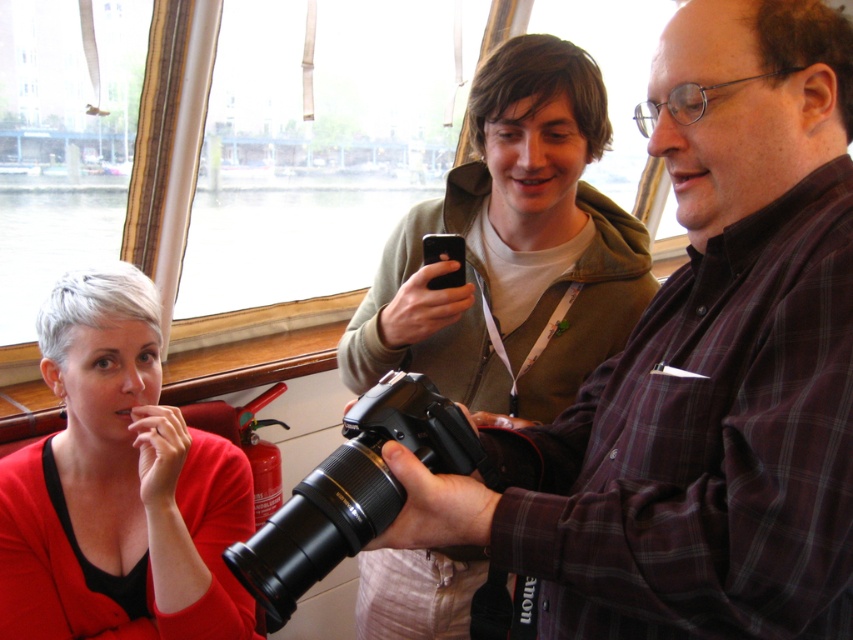
Question: Estimate the real-world distances between objects in this image. Which object is closer to the plaid fabric shirt at center?

Choices:
 (A) matte red sweater at lower left
 (B) black plastic camera at center

Answer: (B)

Question: Can you confirm if matte red sweater at lower left is smaller than black plastic camera at center?

Choices:
 (A) no
 (B) yes

Answer: (A)

Question: Which point is farther to the camera?

Choices:
 (A) black plastic camera at center
 (B) matte red sweater at lower left
 (C) plaid fabric shirt at center

Answer: (B)

Question: Can you confirm if matte red sweater at lower left is positioned below black plastic camera at center?

Choices:
 (A) no
 (B) yes

Answer: (A)

Question: Can you confirm if plaid fabric shirt at center is smaller than black plastic camera at center?

Choices:
 (A) yes
 (B) no

Answer: (B)

Question: Which of these objects is positioned farthest from the black plastic camera at center?

Choices:
 (A) plaid fabric shirt at center
 (B) matte red sweater at lower left

Answer: (B)